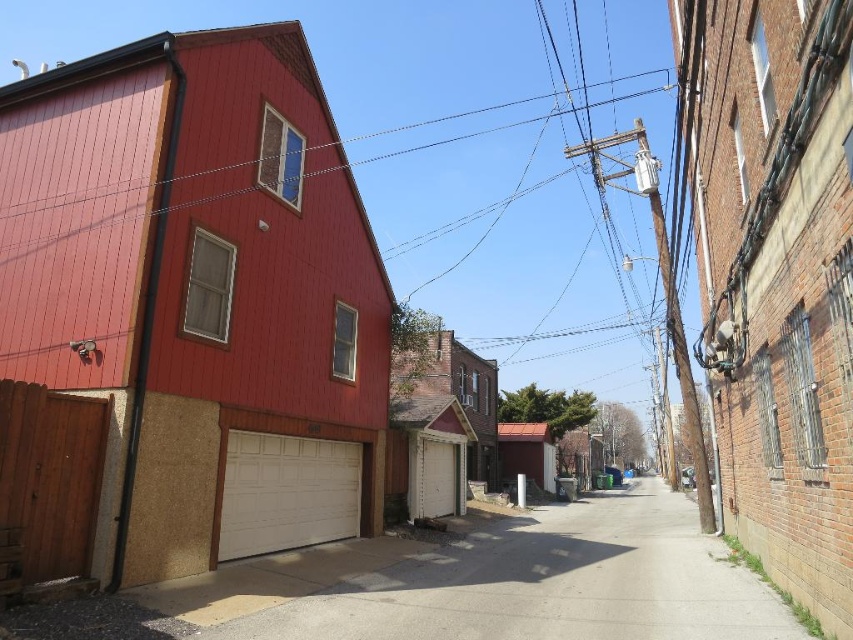
You are a delivery person trying to park a van that is 2 meters wide. You see the white textured garage door at lower center and the white painted wood garage at center. Which garage can accommodate your van based on their sizes?

The white textured garage door at lower center has a larger size compared to the white painted wood garage at center, so it can accommodate the van.

You are driving a delivery van that is 2.5 meters wide. You need to navigate through the narrow alleyway shown in the image. Can your van fit through the white smooth driveway at lower center based on its position?

The white smooth driveway at lower center is located at point (548, 582), but without specific width information, it is impossible to determine if the delivery van can fit through. More details about the driveway dimensions are needed.

You are driving a delivery van that is 2.5 meters wide. You need to navigate through the alleyway and pass between the white smooth driveway at lower center and the white textured garage door at lower center. Can your van fit through the space between them?

The white smooth driveway at lower center is to the right of the white textured garage door at lower center, so the distance between them is not specified. However, since the alley is narrow and the van is 2.5 meters wide, it might be too wide to fit through the narrow space between the driveway and garage door. Please check the actual width before proceeding.